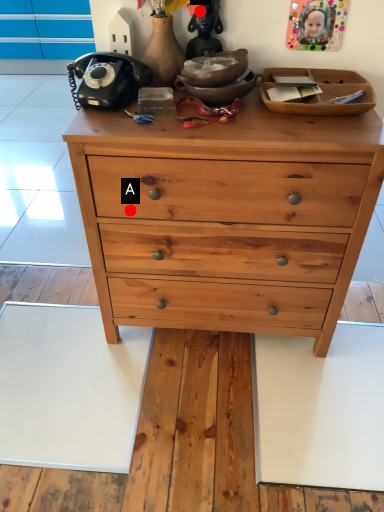
Question: Two points are circled on the image, labeled by A and B beside each circle. Which point is closer to the camera?

Choices:
 (A) A is closer
 (B) B is closer

Answer: (A)